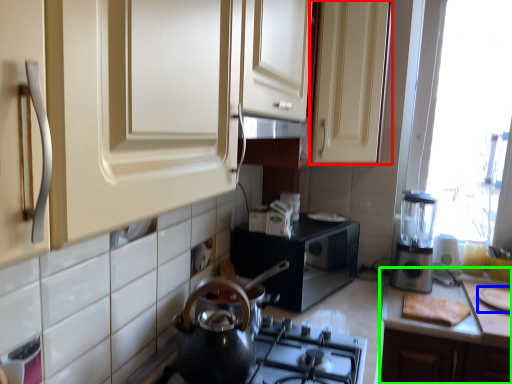
Question: Estimate the real-world distances between objects in this image. Which object is closer to cabinetry (highlighted by a red box), appliance (highlighted by a blue box) or countertop (highlighted by a green box)?

Choices:
 (A) appliance
 (B) countertop

Answer: (B)